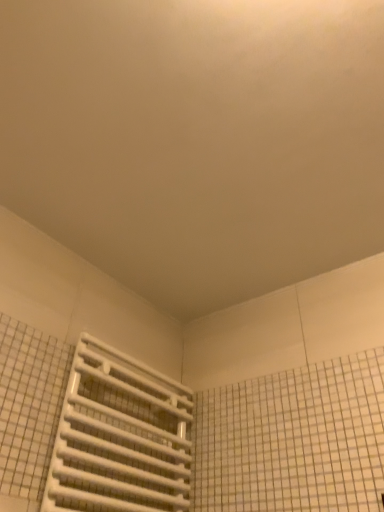
Measure the distance between white matte radiator at center and camera.

white matte radiator at center is 38.41 inches from camera.

Based on the photo, what is the approximate height of white matte radiator at center?

17.95 inches.

Describe the element at coordinates (120, 437) in the screenshot. This screenshot has width=384, height=512. I see `white matte radiator at center` at that location.

Locate an element on the screen. This screenshot has width=384, height=512. white matte radiator at center is located at coordinates (120, 437).

Identify the location of white matte radiator at center. Image resolution: width=384 pixels, height=512 pixels. (120, 437).